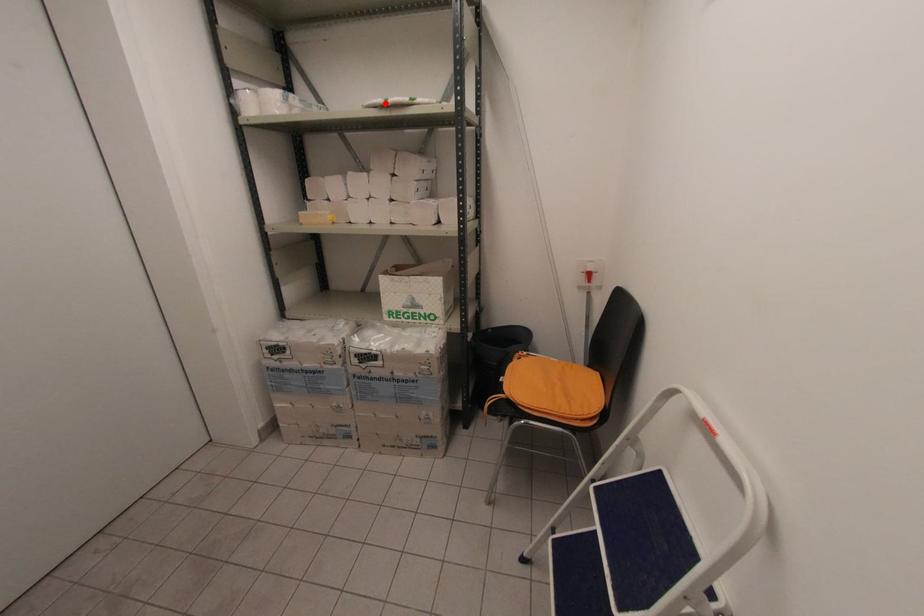
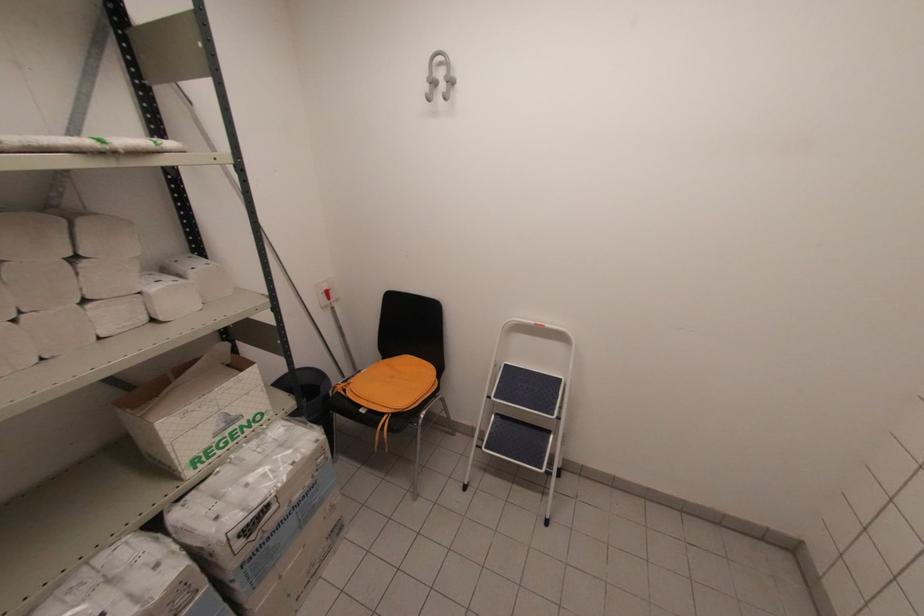
In the second image, find the point that corresponds to the highlighted location in the first image.

(107, 148)